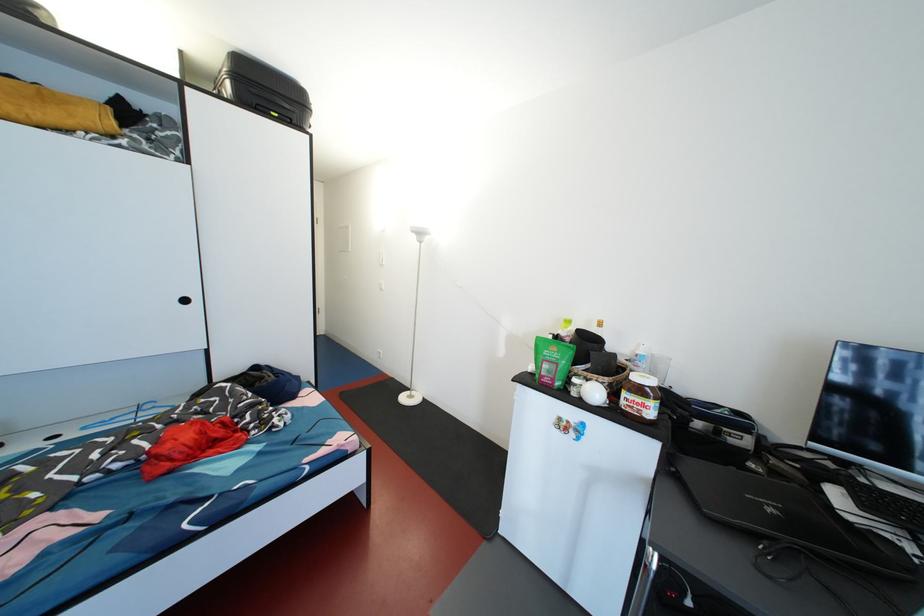
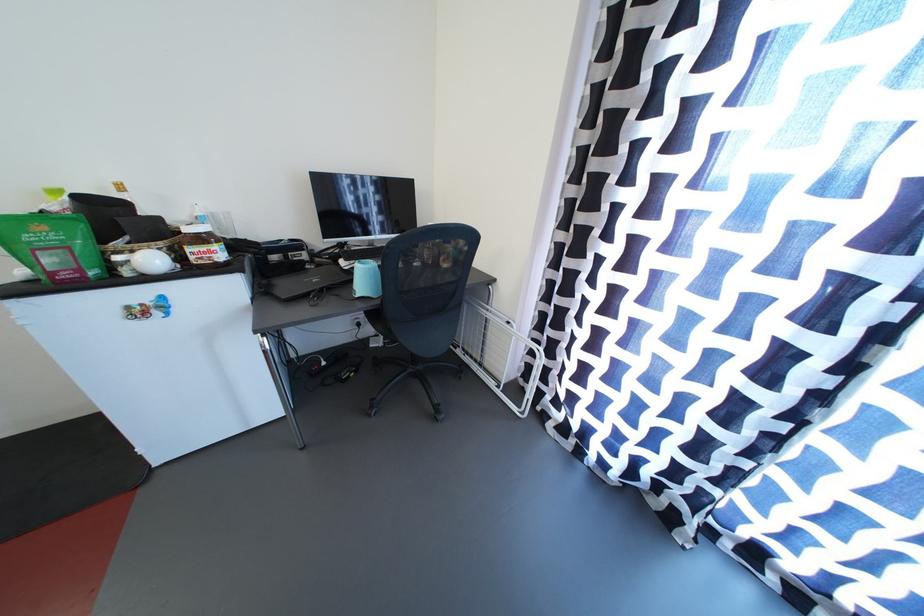
In the second image, find the point that corresponds to pixel 601 397 in the first image.

(157, 265)